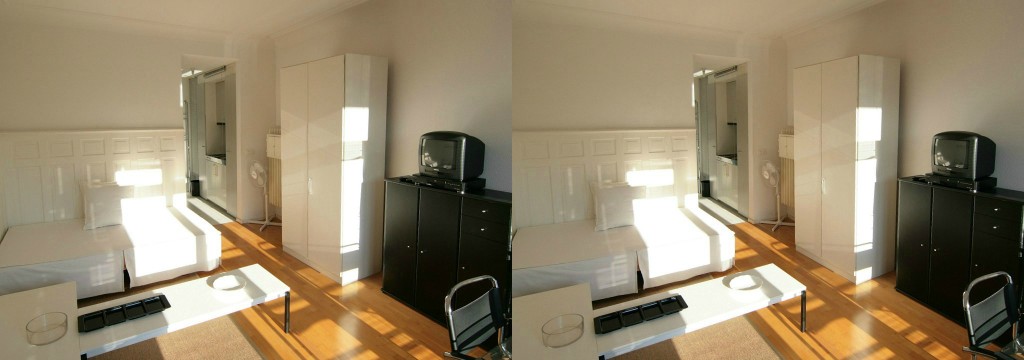
Identify the location of wardrobe. The width and height of the screenshot is (1024, 360). (837, 158), (298, 181).